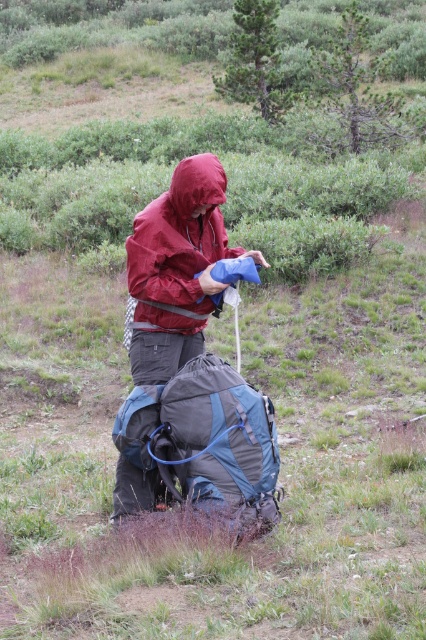
Who is taller, dark gray fabric backpack at center or matte red jacket at center?

matte red jacket at center is taller.

Does dark gray fabric backpack at center have a lesser height compared to matte red jacket at center?

Correct, dark gray fabric backpack at center is not as tall as matte red jacket at center.

You are a GUI agent. You are given a task and a screenshot of the screen. Output one action in this format:
    pyautogui.click(x=<x>, y=<y>)
    Task: Click on the dark gray fabric backpack at center
    The width and height of the screenshot is (426, 640).
    Given the screenshot: What is the action you would take?
    pyautogui.click(x=206, y=442)

Does waterproof nylon jacket at center come behind matte red jacket at center?

No, it is not.

Between waterproof nylon jacket at center and matte red jacket at center, which one is positioned lower?

waterproof nylon jacket at center is lower down.

Is point (224, 252) in front of point (143, 212)?

No, (224, 252) is behind (143, 212).

I want to click on waterproof nylon jacket at center, so click(175, 269).

Describe the element at coordinates (206, 442) in the screenshot. I see `dark gray fabric backpack at center` at that location.

Can you confirm if dark gray fabric backpack at center is positioned to the right of waterproof nylon jacket at center?

Yes, dark gray fabric backpack at center is to the right of waterproof nylon jacket at center.

Which is in front, point (181, 454) or point (135, 348)?

Positioned in front is point (181, 454).

This screenshot has height=640, width=426. Find the location of `dark gray fabric backpack at center`. dark gray fabric backpack at center is located at coordinates (206, 442).